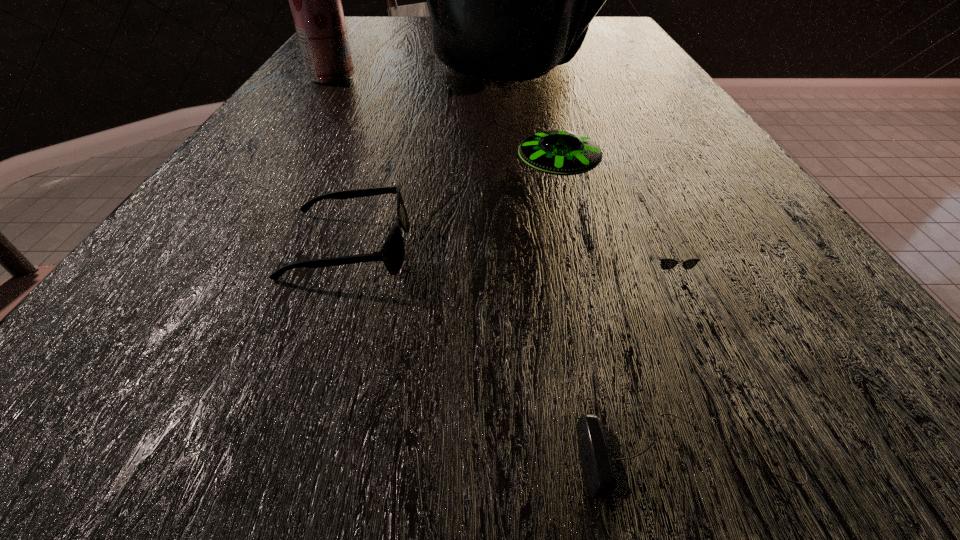
Point out which object is positioned as the fourth nearest to the right sunglasses. Please provide its 2D coordinates. Your answer should be formatted as a tuple, i.e. [(x, y)], where the tuple contains the x and y coordinates of a point satisfying the conditions above.

[(509, 0)]